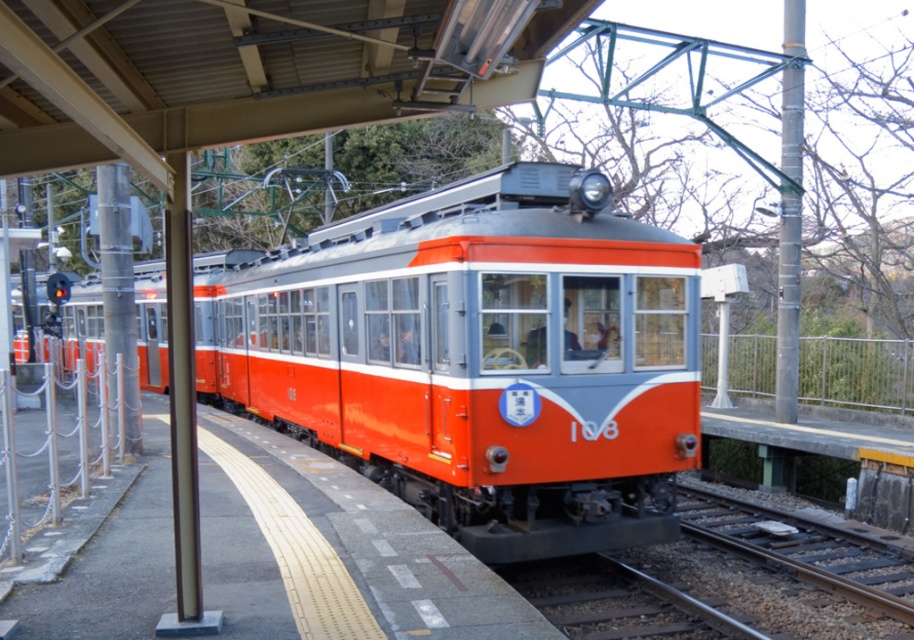
Question: Among these points, which one is nearest to the camera?

Choices:
 (A) tap(800, 625)
 (B) tap(594, 388)

Answer: (A)

Question: Among these objects, which one is farthest from the camera?

Choices:
 (A) matte orange train at center
 (B) smooth metal track at lower center

Answer: (B)

Question: Is matte orange train at center to the right of smooth metal track at lower center from the viewer's perspective?

Choices:
 (A) no
 (B) yes

Answer: (A)

Question: Does matte orange train at center appear on the right side of smooth metal track at lower center?

Choices:
 (A) no
 (B) yes

Answer: (A)

Question: Can you confirm if matte orange train at center is positioned above smooth metal track at lower center?

Choices:
 (A) no
 (B) yes

Answer: (B)

Question: Which point appears closest to the camera in this image?

Choices:
 (A) (385, 228)
 (B) (692, 616)

Answer: (B)